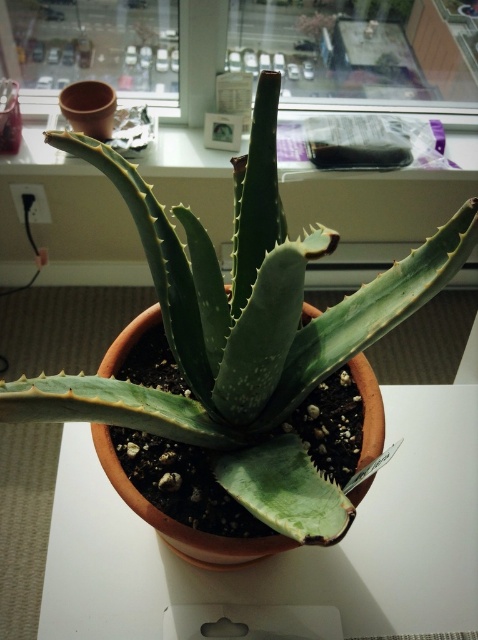
Question: Among these objects, which one is farthest from the camera?

Choices:
 (A) green matte window sill at upper center
 (B) transparent plastic bag at upper center
 (C) matte glass window at upper center
 (D) white matte table at center

Answer: (A)

Question: Can you confirm if white matte table at center is thinner than matte glass window at upper center?

Choices:
 (A) yes
 (B) no

Answer: (B)

Question: Is transparent plastic bag at upper center to the left of matte glass window at upper center from the viewer's perspective?

Choices:
 (A) yes
 (B) no

Answer: (B)

Question: Is green matte window sill at upper center closer to the viewer compared to transparent plastic bag at upper center?

Choices:
 (A) yes
 (B) no

Answer: (B)

Question: Which of the following is the farthest from the observer?

Choices:
 (A) (86, 26)
 (B) (106, 573)
 (C) (264, 48)

Answer: (C)

Question: Which point is closer to the camera taking this photo?

Choices:
 (A) (155, 0)
 (B) (107, 198)

Answer: (A)